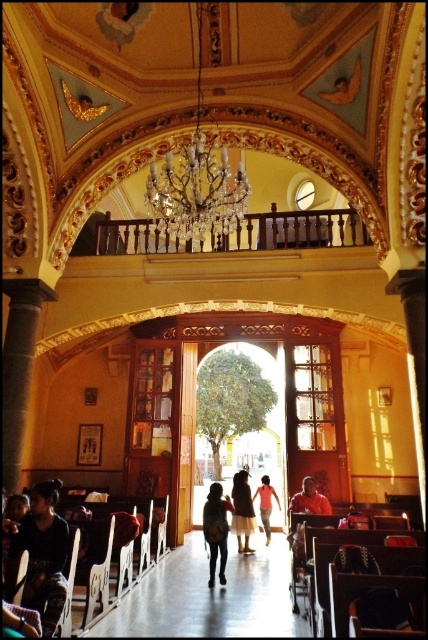
Question: Is dark gray jeans at center bigger than orange fabric person at center?

Choices:
 (A) yes
 (B) no

Answer: (A)

Question: Does wooden balustrade at upper center have a lesser width compared to wooden polished chair at lower left?

Choices:
 (A) yes
 (B) no

Answer: (B)

Question: Which point is farther to the camera?

Choices:
 (A) light pink fabric dress at center
 (B) wooden polished chair at lower left
 (C) dark gray jeans at center

Answer: (A)

Question: Which point is farther from the camera taking this photo?

Choices:
 (A) (265, 484)
 (B) (98, 605)
 (C) (252, 241)

Answer: (A)

Question: Which of the following is the farthest from the observer?

Choices:
 (A) light brown fabric skirt at center
 (B) wooden floor at center

Answer: (A)

Question: Where is wooden floor at center located in relation to dark gray sweater at lower left in the image?

Choices:
 (A) left
 (B) right

Answer: (B)